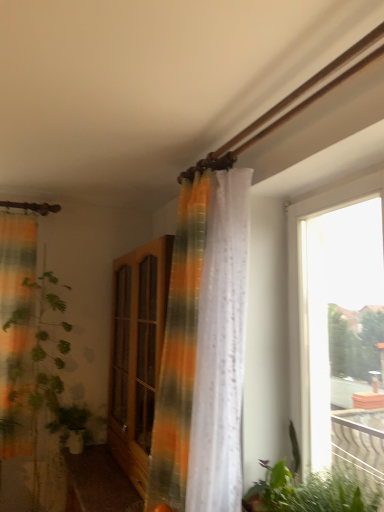
Question: Is green leafy plant at lower right, marked as the 1th vegetation in a front-to-back arrangement, at the right side of green matte plant at lower left, which appears as the first vegetation when viewed from the left?

Choices:
 (A) yes
 (B) no

Answer: (A)

Question: From a real-world perspective, is green leafy plant at lower right, the 1th vegetation viewed from the top, located higher than green matte plant at lower left, which appears as the 1th vegetation when ordered from the bottom?

Choices:
 (A) yes
 (B) no

Answer: (A)

Question: Is green leafy plant at lower right, which ranks as the 1th vegetation in right-to-left order, positioned with its back to green matte plant at lower left, which appears as the first vegetation when viewed from the left?

Choices:
 (A) yes
 (B) no

Answer: (B)

Question: Would you say green matte plant at lower left, which is counted as the first vegetation, starting from the back, is part of green leafy plant at lower right, which ranks as the 1th vegetation in right-to-left order,'s contents?

Choices:
 (A) no
 (B) yes

Answer: (A)

Question: From a real-world perspective, is green leafy plant at lower right, the 2th vegetation from the back, positioned under green matte plant at lower left, which appears as the 1th vegetation when ordered from the bottom, based on gravity?

Choices:
 (A) yes
 (B) no

Answer: (B)

Question: Is green leafy plant at lower right, which ranks as the 1th vegetation in right-to-left order, located outside green matte plant at lower left, acting as the second vegetation starting from the top?

Choices:
 (A) no
 (B) yes

Answer: (B)

Question: Is green matte plant at lower left, arranged as the 2th vegetation when viewed from the front, at the right side of translucent orange-green curtain at center?

Choices:
 (A) yes
 (B) no

Answer: (B)

Question: Is green matte plant at lower left, the 2th vegetation when ordered from right to left, shorter than translucent orange-green curtain at center?

Choices:
 (A) no
 (B) yes

Answer: (B)

Question: Is green matte plant at lower left, acting as the second vegetation starting from the top, placed right next to translucent orange-green curtain at center?

Choices:
 (A) no
 (B) yes

Answer: (A)

Question: Would you say translucent orange-green curtain at center is part of green matte plant at lower left, which appears as the first vegetation when viewed from the left,'s contents?

Choices:
 (A) no
 (B) yes

Answer: (A)

Question: Is green matte plant at lower left, the 2th vegetation when ordered from right to left, outside translucent orange-green curtain at center?

Choices:
 (A) yes
 (B) no

Answer: (A)

Question: Can you confirm if green matte plant at lower left, which appears as the first vegetation when viewed from the left, is smaller than translucent orange-green curtain at center?

Choices:
 (A) no
 (B) yes

Answer: (B)

Question: Is transparent glass window at right at the back of wooden cabinet at center?

Choices:
 (A) yes
 (B) no

Answer: (B)